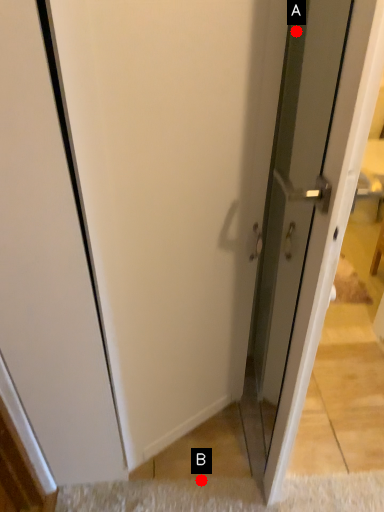
Question: Two points are circled on the image, labeled by A and B beside each circle. Which of the following is the farthest from the observer?

Choices:
 (A) A is further
 (B) B is further

Answer: (B)